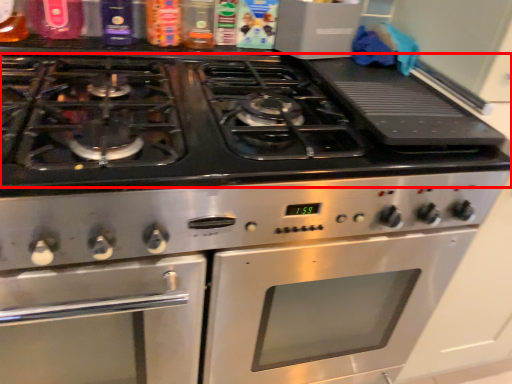
Question: Where is gas stove (annotated by the red box) located in relation to oven in the image?

Choices:
 (A) left
 (B) right

Answer: (B)